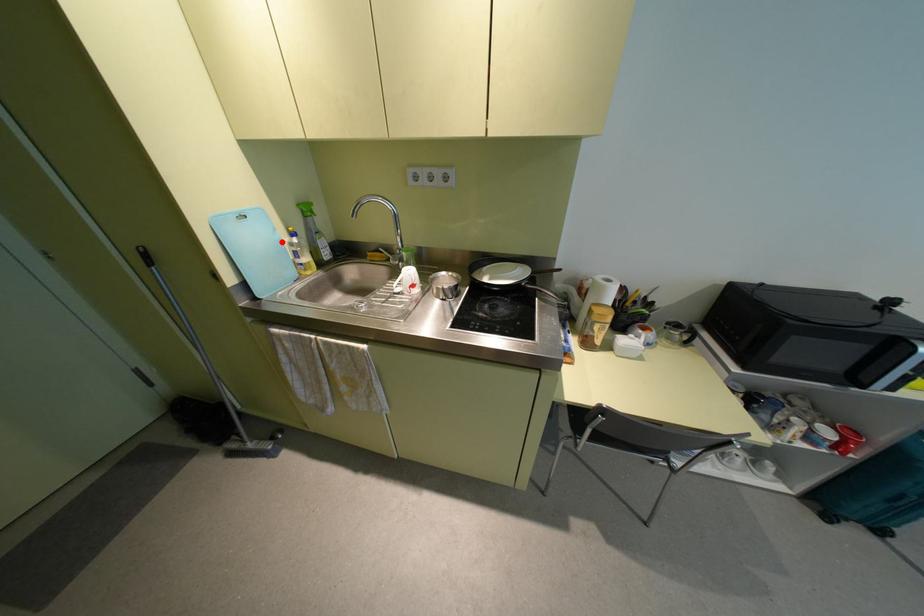
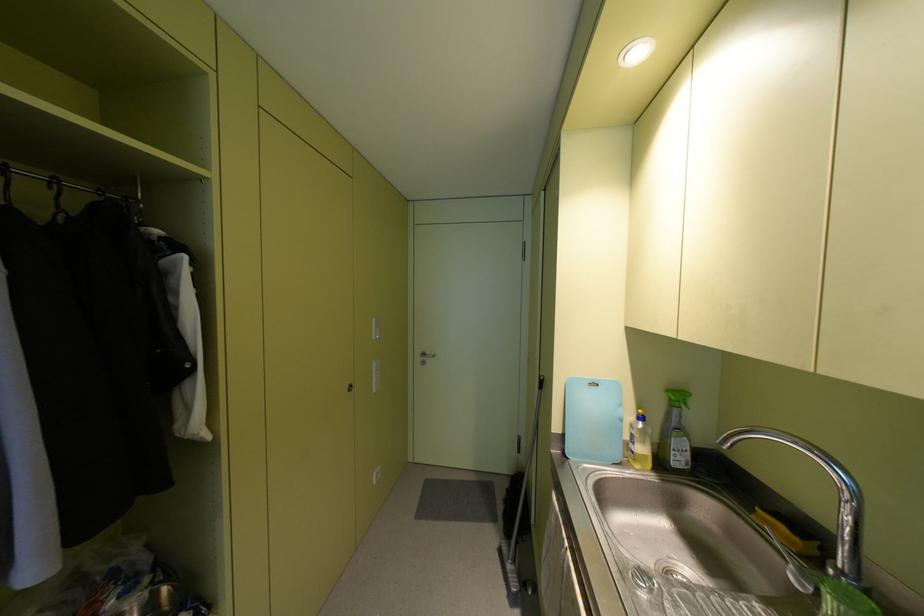
Question: I am providing you with two images of the same scene from different viewpoints. In image1, a red point is highlighted. Considering the same 3D point in image2, which of the following is correct?

Choices:
 (A) It is closer
 (B) It is farther

Answer: (B)